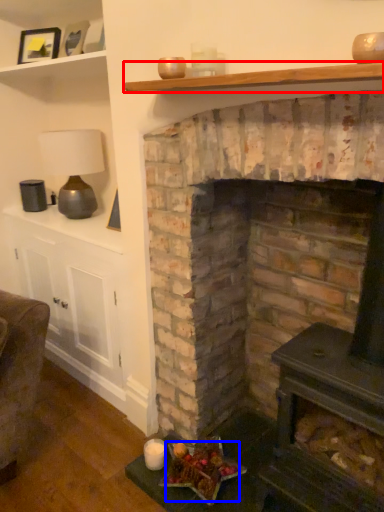
Question: Which object appears closest to the camera in this image, shelf (highlighted by a red box) or food (highlighted by a blue box)?

Choices:
 (A) shelf
 (B) food

Answer: (A)